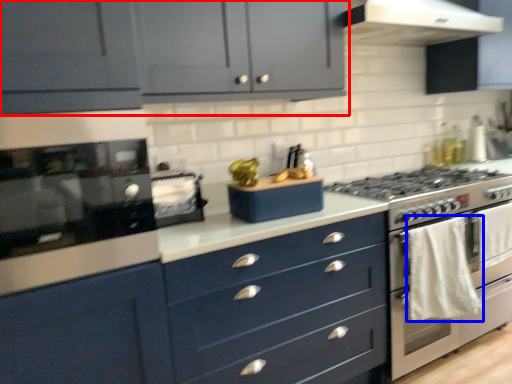
Question: Which object appears farthest to the camera in this image, cabinetry (highlighted by a red box) or material (highlighted by a blue box)?

Choices:
 (A) cabinetry
 (B) material

Answer: (B)